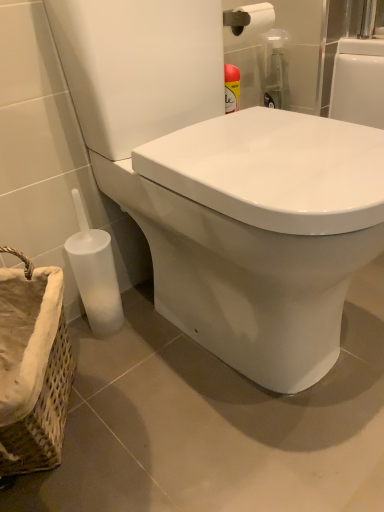
Where is `vacant space that's between white glossy toilet at lower left and white matte toilet brush at lower left`? The width and height of the screenshot is (384, 512). vacant space that's between white glossy toilet at lower left and white matte toilet brush at lower left is located at coordinates (174, 376).